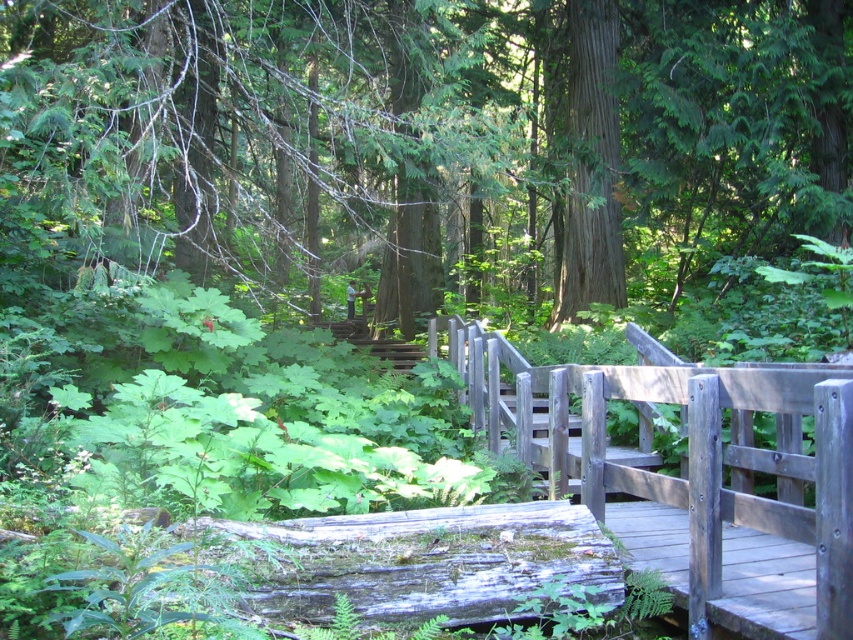
Is point (547, 403) positioned before point (573, 104)?

Yes.

This screenshot has height=640, width=853. Find the location of `wooden bridge at center`. wooden bridge at center is located at coordinates (689, 467).

This screenshot has height=640, width=853. In order to click on wooden bridge at center in this screenshot , I will do `click(689, 467)`.

Does smooth green tree at center appear under wooden bridge at center?

Incorrect, smooth green tree at center is not positioned below wooden bridge at center.

Does smooth green tree at center appear on the left side of wooden bridge at center?

Correct, you'll find smooth green tree at center to the left of wooden bridge at center.

Find the location of a particular element. This screenshot has width=853, height=640. smooth green tree at center is located at coordinates (432, 129).

Does smooth green tree at center lie behind smooth brown tree trunk at upper center?

That is False.

Image resolution: width=853 pixels, height=640 pixels. What do you see at coordinates (432, 129) in the screenshot?
I see `smooth green tree at center` at bounding box center [432, 129].

The width and height of the screenshot is (853, 640). In order to click on smooth green tree at center in this screenshot , I will do `click(432, 129)`.